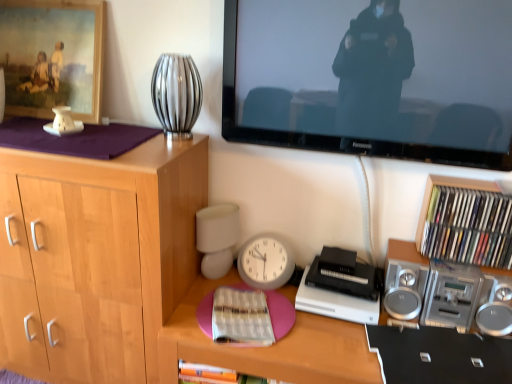
What are the coordinates of `blank space situated above light wood cabinet at left (from a real-world perspective)` in the screenshot? It's located at (58, 130).